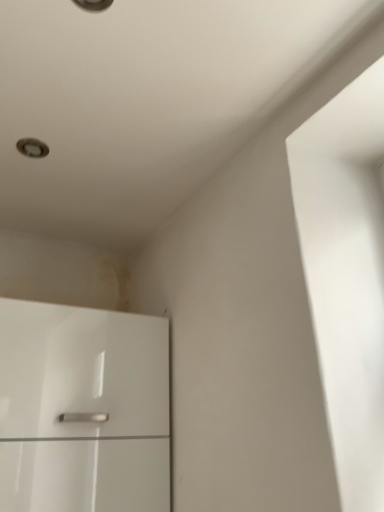
Question: Is point (34, 152) positioned closer to the camera than point (56, 349)?

Choices:
 (A) farther
 (B) closer

Answer: (A)

Question: From the image's perspective, relative to glossy white cabinet at lower left, is matte silver light fixture at upper left above or below?

Choices:
 (A) above
 (B) below

Answer: (A)

Question: From a real-world perspective, is matte silver light fixture at upper left above or below glossy white cabinet at lower left?

Choices:
 (A) above
 (B) below

Answer: (A)

Question: In terms of width, does glossy white cabinet at lower left look wider or thinner when compared to matte silver light fixture at upper left?

Choices:
 (A) thin
 (B) wide

Answer: (B)

Question: Considering the positions of glossy white cabinet at lower left and matte silver light fixture at upper left in the image, is glossy white cabinet at lower left taller or shorter than matte silver light fixture at upper left?

Choices:
 (A) short
 (B) tall

Answer: (B)

Question: From a real-world perspective, relative to matte silver light fixture at upper left, is glossy white cabinet at lower left vertically above or below?

Choices:
 (A) above
 (B) below

Answer: (B)

Question: Is point (125, 474) positioned closer to the camera than point (26, 148)?

Choices:
 (A) closer
 (B) farther

Answer: (A)